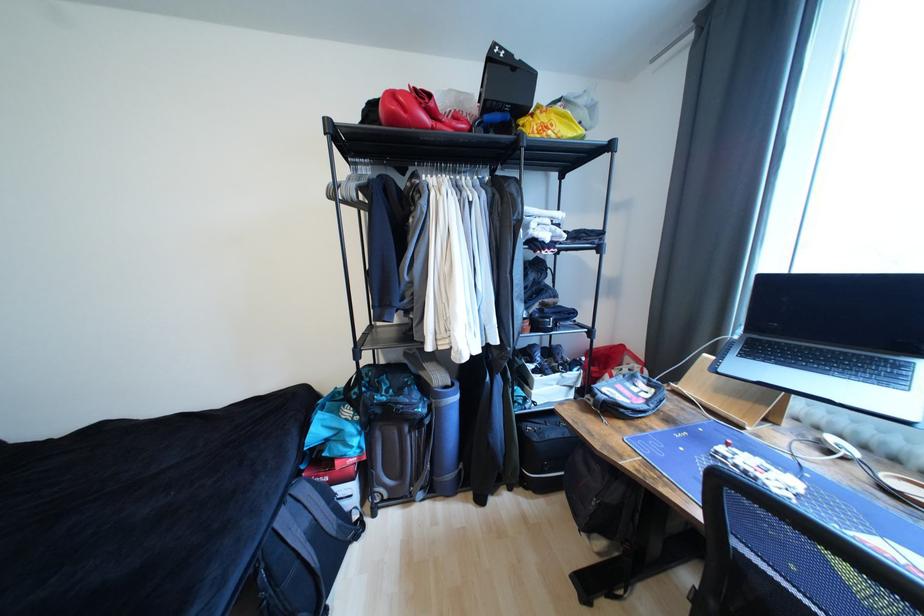
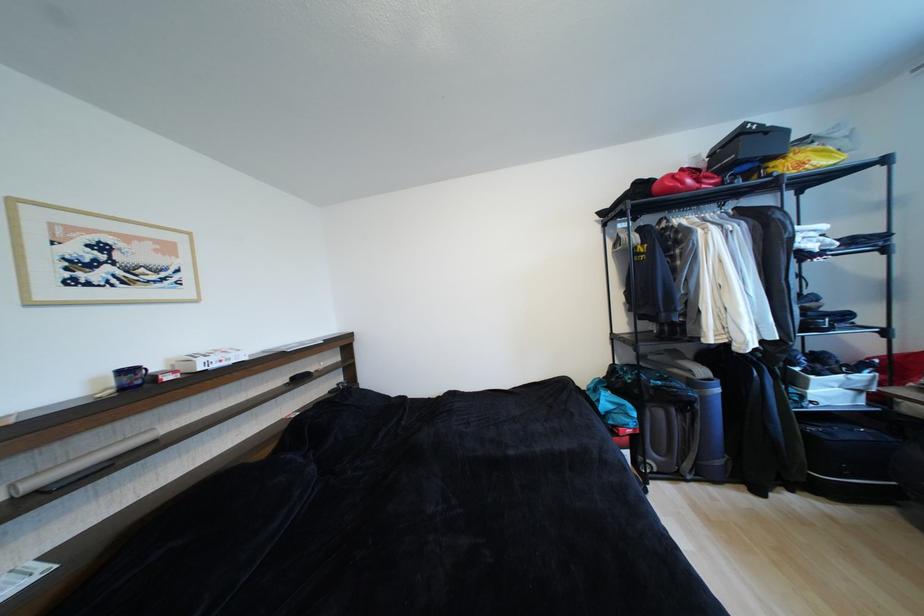
Find the pixel in the second image that matches the point at 400,121 in the first image.

(676, 192)